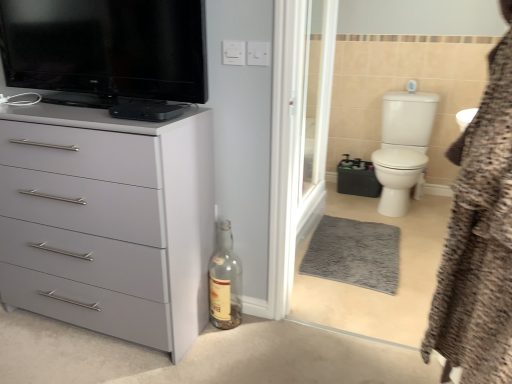
I want to click on free area in between matte gray chest of drawers at left and clear glass bottle at lower center, so click(x=202, y=345).